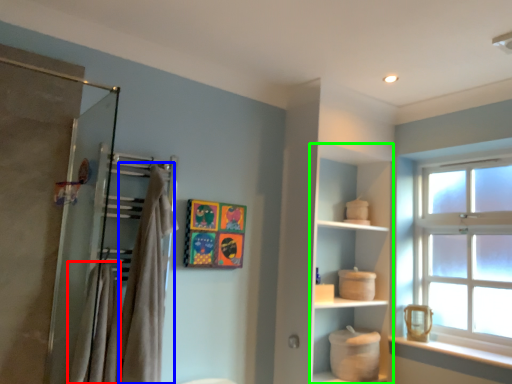
Question: Which object is positioned farthest from bath towel (highlighted by a red box)? Select from bath towel (highlighted by a blue box) and cabinet (highlighted by a green box).

Choices:
 (A) bath towel
 (B) cabinet

Answer: (B)